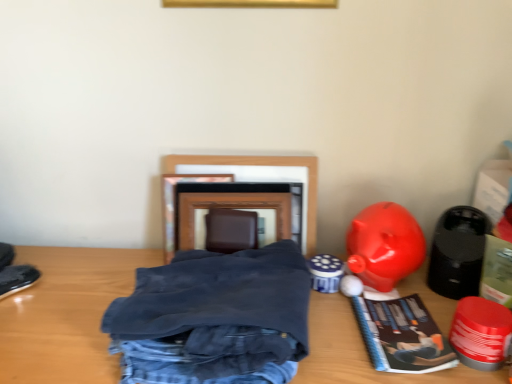
The width and height of the screenshot is (512, 384). Find the location of `free spot behind black suede shoe at left`. free spot behind black suede shoe at left is located at coordinates (55, 259).